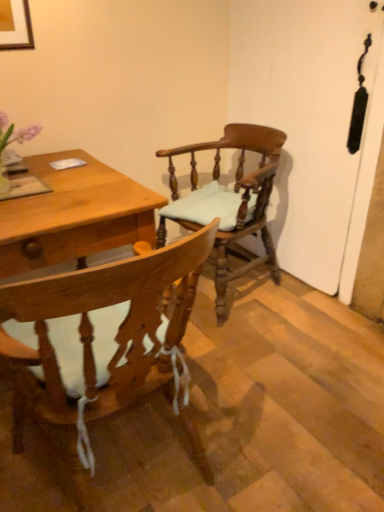
Question: In the image, is wooden chair with white cushion at center, placed as the first chair when sorted from front to back, on the left side or the right side of wooden chair with cushion at center, which is counted as the 1th chair, starting from the back?

Choices:
 (A) right
 (B) left

Answer: (B)

Question: In the image, is wooden chair with white cushion at center, the 2th chair viewed from the back, positioned in front of or behind wooden chair with cushion at center, placed as the second chair when sorted from front to back?

Choices:
 (A) behind
 (B) front

Answer: (B)

Question: Is wooden chair with white cushion at center, placed as the first chair when sorted from front to back, situated inside wooden chair with cushion at center, placed as the second chair when sorted from front to back, or outside?

Choices:
 (A) outside
 (B) inside

Answer: (A)

Question: In the image, is wooden chair with cushion at center, which is counted as the 1th chair, starting from the back, on the left side or the right side of wooden chair with white cushion at center, the 2th chair viewed from the back?

Choices:
 (A) left
 (B) right

Answer: (B)

Question: From the image's perspective, is wooden chair with cushion at center, placed as the second chair when sorted from front to back, located above or below wooden chair with white cushion at center, placed as the first chair when sorted from front to back?

Choices:
 (A) below
 (B) above

Answer: (B)

Question: Choose the correct answer: Is wooden chair with cushion at center, placed as the second chair when sorted from front to back, inside wooden chair with white cushion at center, placed as the first chair when sorted from front to back, or outside it?

Choices:
 (A) inside
 (B) outside

Answer: (B)

Question: Based on their sizes in the image, would you say wooden chair with cushion at center, which is counted as the 1th chair, starting from the back, is bigger or smaller than wooden chair with white cushion at center, the 2th chair viewed from the back?

Choices:
 (A) small
 (B) big

Answer: (B)